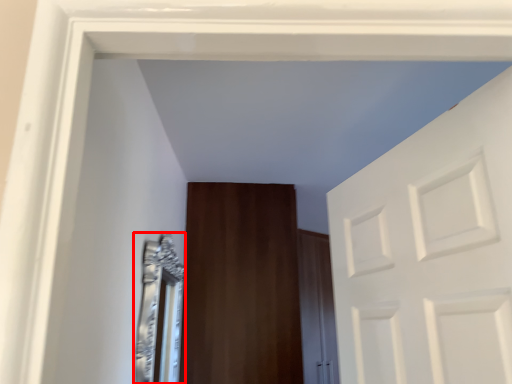
Question: From the image's perspective, where is mirror (annotated by the red box) located in relation to door in the image?

Choices:
 (A) below
 (B) above

Answer: (B)